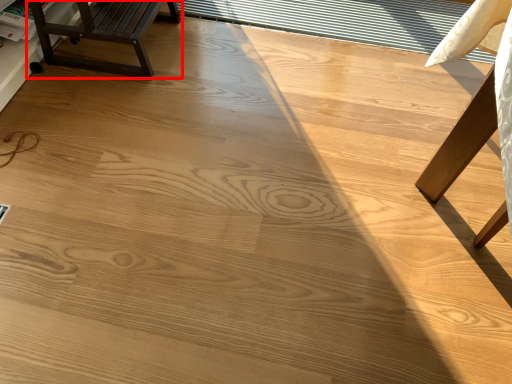
Question: In this image, where is furniture (annotated by the red box) located relative to window?

Choices:
 (A) left
 (B) right

Answer: (A)